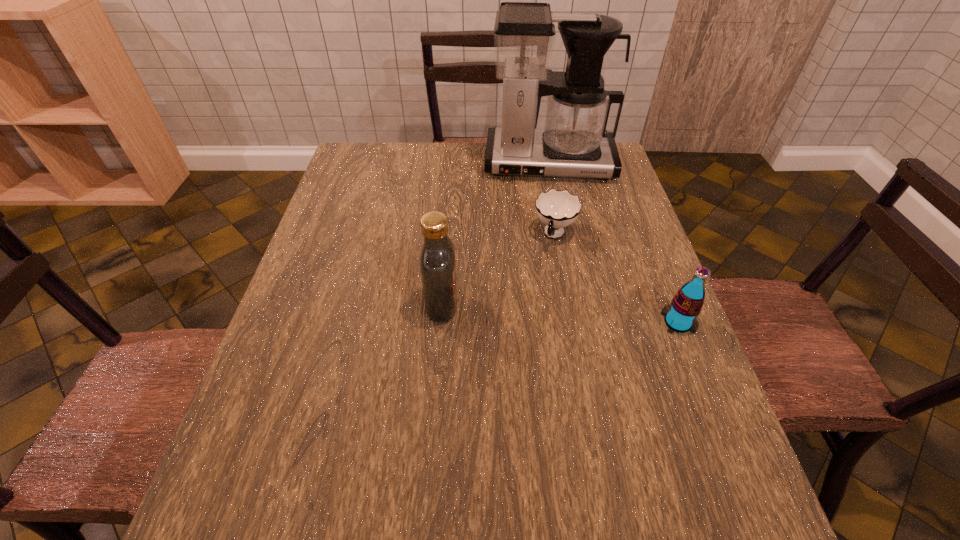
Locate an element on the screen. The image size is (960, 540). unoccupied area between the third nearest object and the vodka is located at coordinates [498, 270].

The height and width of the screenshot is (540, 960). What are the coordinates of `free space between the farthest object and the second shortest object` in the screenshot? It's located at (613, 242).

Identify the location of free space between the leftmost object and the tallest object. This screenshot has width=960, height=540. (495, 234).

Find the location of `free space between the leftmost object and the third tallest object`. free space between the leftmost object and the third tallest object is located at coordinates (560, 313).

The height and width of the screenshot is (540, 960). Find the location of `free space between the soda and the shortest object`. free space between the soda and the shortest object is located at coordinates (616, 279).

Image resolution: width=960 pixels, height=540 pixels. Identify the location of the second closest object to the farthest object. (437, 263).

Identify the location of object that can be found as the second closest to the third tallest object. pyautogui.click(x=437, y=263).

Find the location of a particular element. free space that satisfies the following two spatial constraints: 1. on the front side of the second shortest object; 2. on the right side of the cup is located at coordinates (570, 322).

You are a GUI agent. You are given a task and a screenshot of the screen. Output one action in this format:
    pyautogui.click(x=<x>, y=<y>)
    Task: Click on the vacant space that satisfies the following two spatial constraints: 1. on the back side of the cup; 2. on the left side of the tallest object
    This screenshot has width=960, height=540.
    Given the screenshot: What is the action you would take?
    pyautogui.click(x=541, y=163)

The image size is (960, 540). I want to click on vacant area in the image that satisfies the following two spatial constraints: 1. on the back side of the third nearest object; 2. on the left side of the coffee maker, so click(x=541, y=163).